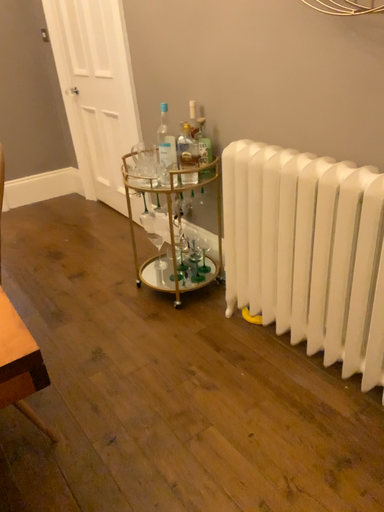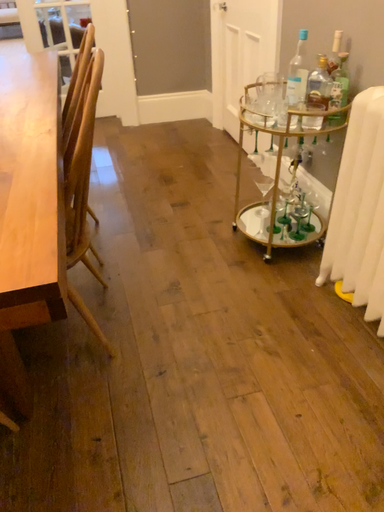
Question: Which way did the camera rotate in the video?

Choices:
 (A) rotated right
 (B) rotated left

Answer: (B)